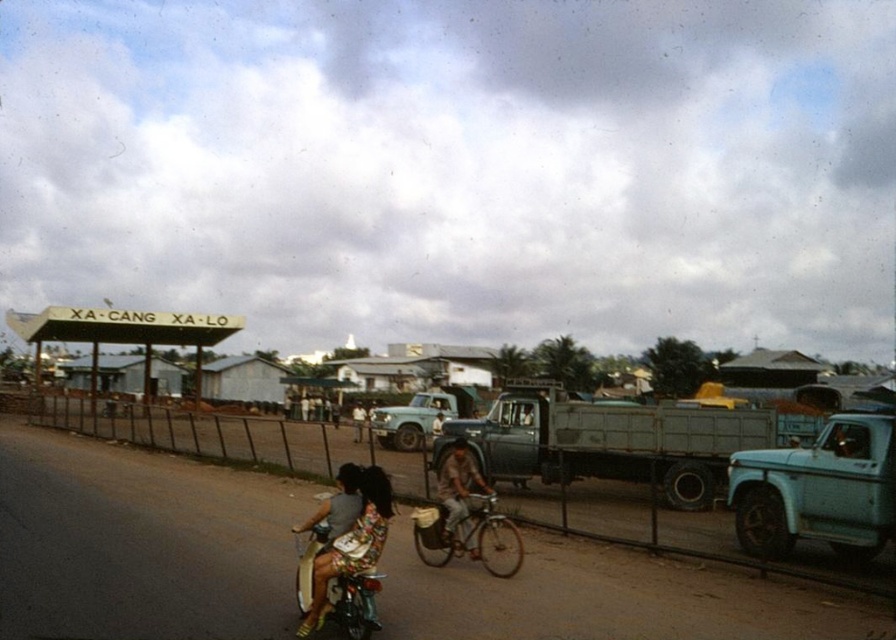
Is light blue metallic truck at center positioned in front of light brown wooden bicycle at center?

No.

Which is behind, point (420, 400) or point (462, 509)?

Point (420, 400)

Which is in front, point (418, 422) or point (457, 502)?

Positioned in front is point (457, 502).

Find the location of `light blue metallic truck at center`. light blue metallic truck at center is located at coordinates (411, 419).

Locate an element on the screen. light blue metallic truck at right is located at coordinates (817, 490).

Does brown dirt track at center have a greater width compared to metallic silver motorcycle at lower left?

Indeed, brown dirt track at center has a greater width compared to metallic silver motorcycle at lower left.

Does brown dirt track at center appear under metallic silver motorcycle at lower left?

Indeed, brown dirt track at center is positioned under metallic silver motorcycle at lower left.

Is point (867, 620) farther from viewer compared to point (356, 576)?

Yes, it is behind point (356, 576).

Locate an element on the screen. brown dirt track at center is located at coordinates (139, 541).